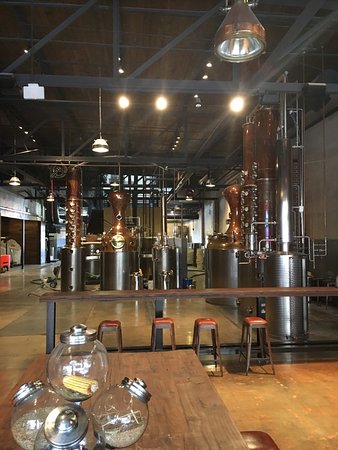
Find the location of a particular element. canisters is located at coordinates (101, 359), (123, 401), (31, 401), (86, 443).